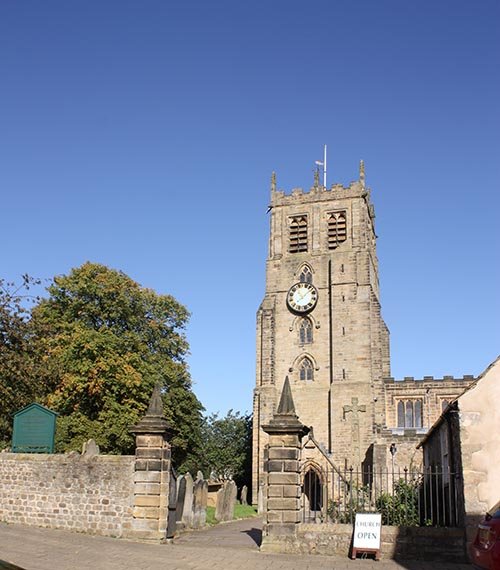
Where is `beige and gray brick wall`? beige and gray brick wall is located at coordinates (77, 502), (144, 490), (270, 494), (442, 536).